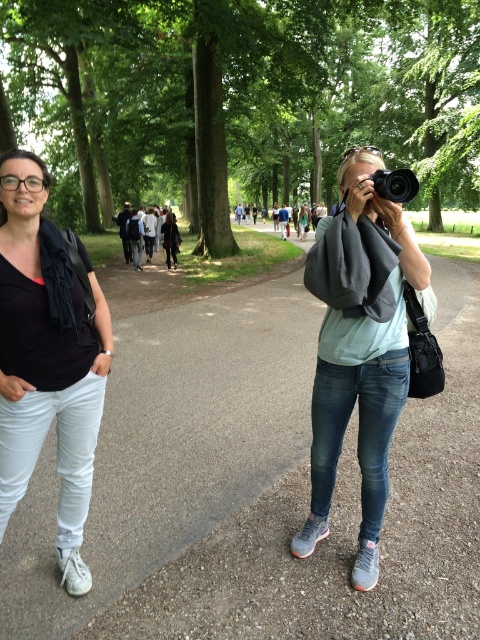
You are a photographer standing in the park. You notice the matte black shirt at left and the black plastic camera at center. Which object is positioned lower in the image?

The matte black shirt at left is positioned below the black plastic camera at center, so it is lower in the image.

You are planning to walk along the smooth asphalt path at center while carrying the black plastic camera at center. If you want to ensure the camera doesn

The smooth asphalt path at center is larger in size than the black plastic camera at center, so the path should be wide enough to comfortably accommodate the camera while walking.